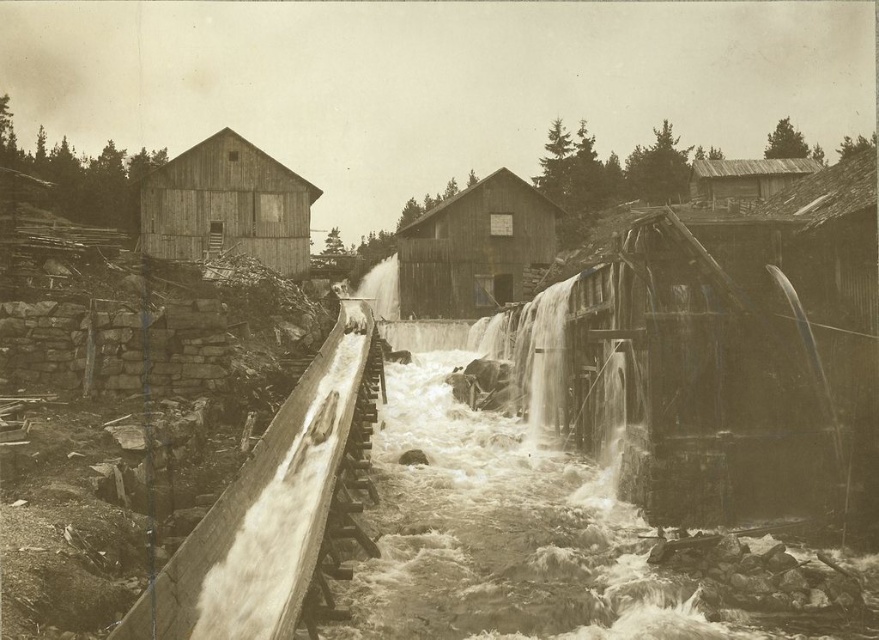
Question: Can you confirm if rough stone river at center is thinner than wooden hut at left?

Choices:
 (A) yes
 (B) no

Answer: (A)

Question: Is wooden hut at left to the right of white frothy water at center from the viewer's perspective?

Choices:
 (A) no
 (B) yes

Answer: (A)

Question: Which object is positioned closest to the wooden hut at left?

Choices:
 (A) white frothy water at center
 (B) smooth concrete waterfall at center

Answer: (A)

Question: Which object appears farthest from the camera in this image?

Choices:
 (A) wooden hut at center
 (B) rusty metal hut at upper right

Answer: (B)

Question: Is rough stone river at center positioned at the back of wooden hut at left?

Choices:
 (A) yes
 (B) no

Answer: (B)

Question: Which point is farther to the camera?

Choices:
 (A) wooden hut at left
 (B) white frothy water at center

Answer: (B)